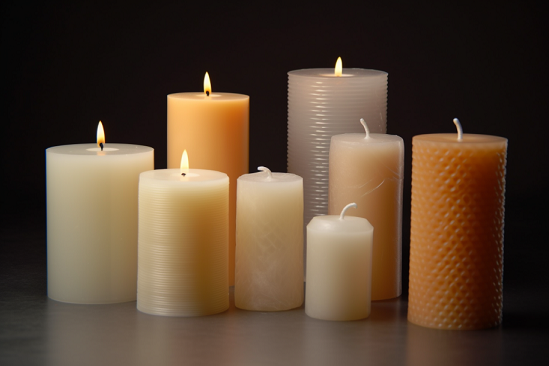
Locate an element on the screen. The image size is (549, 366). candles is located at coordinates (105, 218), (214, 250), (232, 139), (330, 105), (358, 161), (277, 212), (360, 267), (478, 221).